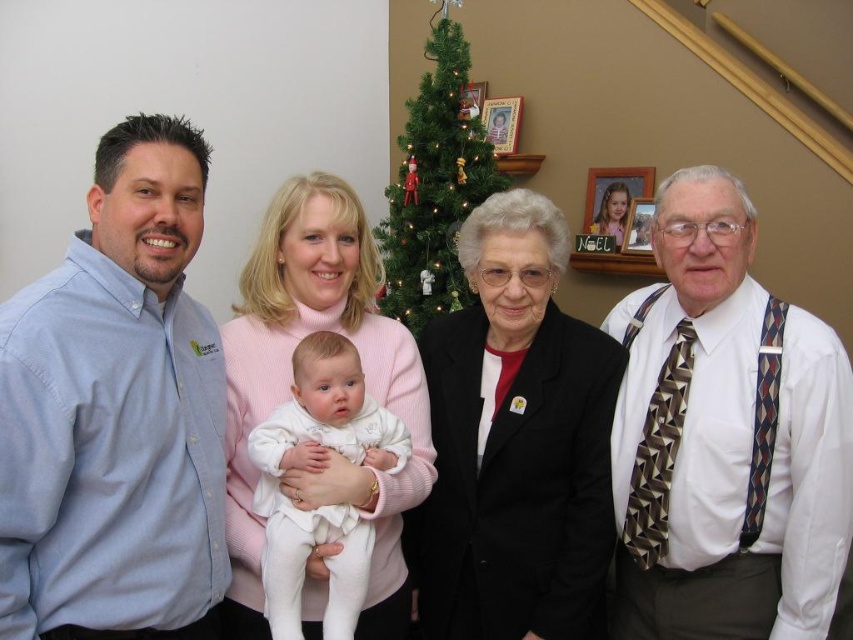
You are a photographer trying to capture a group photo of the family. You need to ensure that both the white textured shirt at right and the green artificial christmas tree at center are visible in the frame. Based on their positions, which object should you position closer to the left side of the camera to include both in the shot?

The white textured shirt at right is to the right of the green artificial christmas tree at center. To include both in the frame, you should position the green artificial christmas tree at center closer to the left side so that the white textured shirt at right can be accommodated on the right side of the camera.

You are standing at the position of point (432,60) and want to walk to the Christmas tree in the background. There is a point at (640,600) in your path. Can you walk straight ahead without deviating from your path to reach the Christmas tree?

Yes, you can walk straight ahead because point (640,600) is in front of point (432,60), meaning it lies along your path towards the Christmas tree.